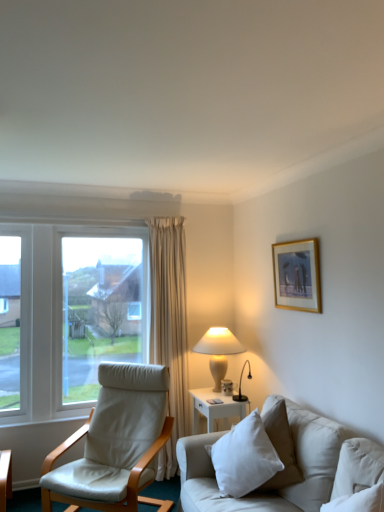
Question: Is white ceramic table lamp at center-right thinner than white fabric couch at lower right?

Choices:
 (A) yes
 (B) no

Answer: (B)

Question: Does white ceramic table lamp at center-right appear on the right side of white fabric couch at lower right?

Choices:
 (A) no
 (B) yes

Answer: (A)

Question: Is white ceramic table lamp at center-right positioned in front of white fabric couch at lower right?

Choices:
 (A) no
 (B) yes

Answer: (A)

Question: Would you say white ceramic table lamp at center-right contains white fabric couch at lower right?

Choices:
 (A) yes
 (B) no

Answer: (B)

Question: Can you confirm if white ceramic table lamp at center-right is wider than white fabric couch at lower right?

Choices:
 (A) yes
 (B) no

Answer: (A)

Question: From a real-world perspective, is white ceramic table lamp at center-right positioned under white fabric couch at lower right based on gravity?

Choices:
 (A) yes
 (B) no

Answer: (B)

Question: Is gold-framed artwork at upper right surrounding white leather chair at left?

Choices:
 (A) no
 (B) yes

Answer: (A)

Question: From a real-world perspective, does gold-framed artwork at upper right stand above white leather chair at left?

Choices:
 (A) no
 (B) yes

Answer: (B)

Question: Would you say gold-framed artwork at upper right is outside white leather chair at left?

Choices:
 (A) no
 (B) yes

Answer: (B)

Question: Can you confirm if gold-framed artwork at upper right is wider than white leather chair at left?

Choices:
 (A) no
 (B) yes

Answer: (A)

Question: Can you confirm if gold-framed artwork at upper right is bigger than white leather chair at left?

Choices:
 (A) no
 (B) yes

Answer: (A)

Question: Could you tell me if gold-framed artwork at upper right is facing white leather chair at left?

Choices:
 (A) yes
 (B) no

Answer: (B)

Question: Is gold-framed artwork at upper right positioned with its back to white fabric couch at lower right?

Choices:
 (A) yes
 (B) no

Answer: (B)